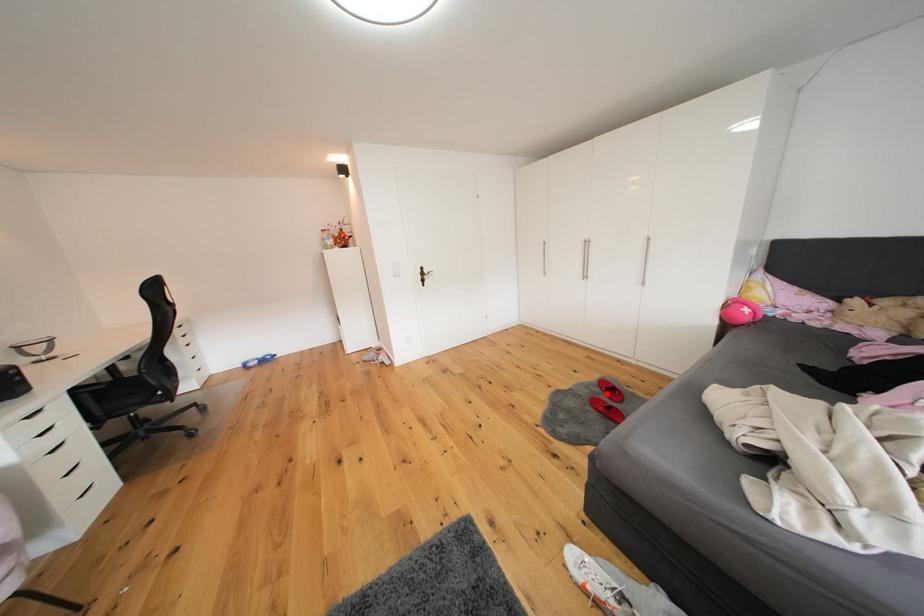
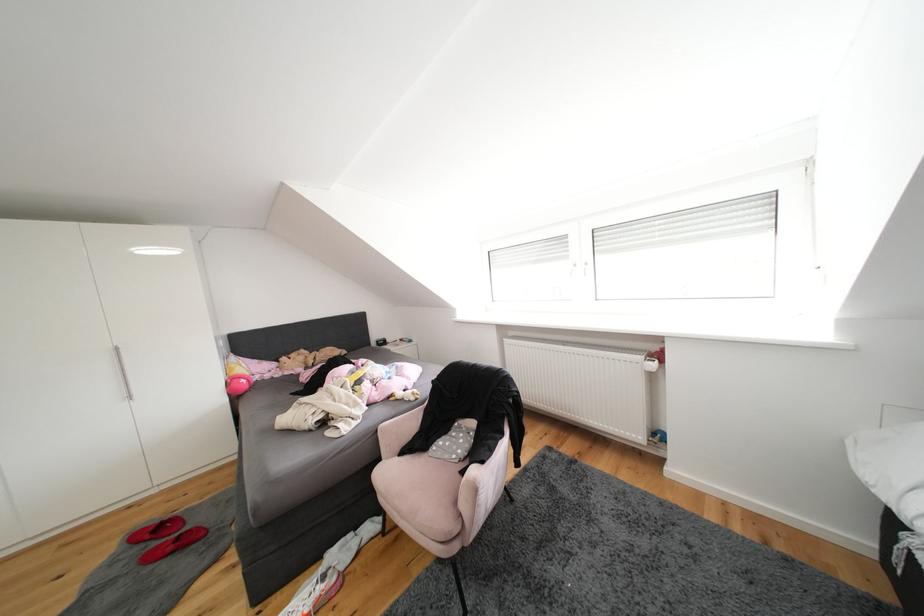
Locate, in the second image, the point that corresponds to the highlighted location in the first image.

(146, 553)